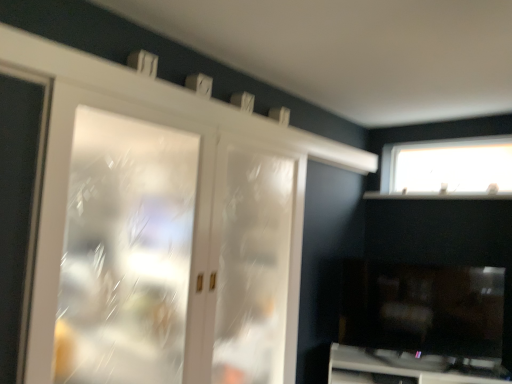
What is the approximate width of clear glass door at center, the 2th screen door in the left-to-right sequence?

The width of clear glass door at center, the 2th screen door in the left-to-right sequence, is 13.12 centimeters.

The image size is (512, 384). Describe the element at coordinates (176, 256) in the screenshot. I see `white frosted glass screen door at left, the first screen door in the left-to-right sequence` at that location.

Where is `white glossy cabinet at lower right`? The height and width of the screenshot is (384, 512). white glossy cabinet at lower right is located at coordinates (409, 368).

Find the location of a particular element. The height and width of the screenshot is (384, 512). transparent glass window at upper right is located at coordinates (448, 167).

Which object is wider, clear glass door at center, the 2th screen door in the left-to-right sequence, or transparent glass window at upper right?

clear glass door at center, the 2th screen door in the left-to-right sequence.

Is clear glass door at center, the first screen door in the right-to-left sequence, to the left of transparent glass window at upper right from the viewer's perspective?

Correct, you'll find clear glass door at center, the first screen door in the right-to-left sequence, to the left of transparent glass window at upper right.

Are clear glass door at center, the 2th screen door in the left-to-right sequence, and transparent glass window at upper right far apart?

Yes, clear glass door at center, the 2th screen door in the left-to-right sequence, and transparent glass window at upper right are quite far apart.

Could you measure the distance between clear glass door at center, the 2th screen door in the left-to-right sequence, and transparent glass window at upper right?

They are 5.03 feet apart.

From a real-world perspective, is clear glass door at center, the first screen door in the right-to-left sequence, under white frosted glass screen door at left, the first screen door in the left-to-right sequence?

Yes, from a real-world perspective, clear glass door at center, the first screen door in the right-to-left sequence, is beneath white frosted glass screen door at left, the first screen door in the left-to-right sequence.

Looking at the image, does clear glass door at center, placed as the second screen door when sorted from front to back, seem bigger or smaller compared to white frosted glass screen door at left, the second screen door positioned from the right?

Clearly, clear glass door at center, placed as the second screen door when sorted from front to back, is larger in size than white frosted glass screen door at left, the second screen door positioned from the right.

Is the depth of clear glass door at center, the first screen door in the right-to-left sequence, less than that of white frosted glass screen door at left, the 1th screen door from the front?

No, clear glass door at center, the first screen door in the right-to-left sequence, is further to the viewer.

Is clear glass door at center, positioned as the 1th screen door in back-to-front order, shorter than white frosted glass screen door at left, the second screen door positioned from the back?

No, clear glass door at center, positioned as the 1th screen door in back-to-front order, is not shorter than white frosted glass screen door at left, the second screen door positioned from the back.

Is white frosted glass screen door at left, the first screen door in the left-to-right sequence, looking in the opposite direction of white glossy cabinet at lower right?

white frosted glass screen door at left, the first screen door in the left-to-right sequence, is not turned away from white glossy cabinet at lower right.

From the image's perspective, is white frosted glass screen door at left, the 1th screen door from the front, positioned above or below white glossy cabinet at lower right?

From the image's perspective, white frosted glass screen door at left, the 1th screen door from the front, appears above white glossy cabinet at lower right.

Considering the positions of objects white frosted glass screen door at left, the second screen door positioned from the right, and white glossy cabinet at lower right in the image provided, who is more to the left, white frosted glass screen door at left, the second screen door positioned from the right, or white glossy cabinet at lower right?

white frosted glass screen door at left, the second screen door positioned from the right, is more to the left.

Considering the sizes of objects white glossy cabinet at lower right and white frosted glass screen door at left, the first screen door in the left-to-right sequence, in the image provided, who is taller, white glossy cabinet at lower right or white frosted glass screen door at left, the first screen door in the left-to-right sequence,?

With more height is white frosted glass screen door at left, the first screen door in the left-to-right sequence.

Considering the sizes of objects white glossy cabinet at lower right and white frosted glass screen door at left, the second screen door positioned from the right, in the image provided, who is thinner, white glossy cabinet at lower right or white frosted glass screen door at left, the second screen door positioned from the right,?

white frosted glass screen door at left, the second screen door positioned from the right.

Considering the relative positions of white glossy cabinet at lower right and white frosted glass screen door at left, the first screen door in the left-to-right sequence, in the image provided, is white glossy cabinet at lower right to the left or to the right of white frosted glass screen door at left, the first screen door in the left-to-right sequence,?

white glossy cabinet at lower right is positioned on white frosted glass screen door at left, the first screen door in the left-to-right sequence,'s right side.

In the scene shown: Would you say white glossy cabinet at lower right is outside white frosted glass screen door at left, the first screen door in the left-to-right sequence?

Yes, white glossy cabinet at lower right is not within white frosted glass screen door at left, the first screen door in the left-to-right sequence.

Measure the distance between white glossy cabinet at lower right and clear glass door at center, placed as the second screen door when sorted from front to back.

white glossy cabinet at lower right and clear glass door at center, placed as the second screen door when sorted from front to back, are 3.74 feet apart from each other.

Is clear glass door at center, the 2th screen door in the left-to-right sequence, located within white glossy cabinet at lower right?

No, clear glass door at center, the 2th screen door in the left-to-right sequence, is located outside of white glossy cabinet at lower right.

In order to click on cabinetry below the clear glass door at center, the 2th screen door in the left-to-right sequence (from the image's perspective) in this screenshot , I will do 409,368.

From a real-world perspective, is white glossy cabinet at lower right on clear glass door at center, the 2th screen door in the left-to-right sequence?

Incorrect, from a real-world perspective, white glossy cabinet at lower right is lower than clear glass door at center, the 2th screen door in the left-to-right sequence.

Are transparent glass window at upper right and white glossy cabinet at lower right located far from each other?

Indeed, transparent glass window at upper right is not near white glossy cabinet at lower right.

Between transparent glass window at upper right and white glossy cabinet at lower right, which one is positioned in front?

white glossy cabinet at lower right is closer to the camera.

Is transparent glass window at upper right thinner than white glossy cabinet at lower right?

Indeed, transparent glass window at upper right has a lesser width compared to white glossy cabinet at lower right.

Between transparent glass window at upper right and white glossy cabinet at lower right, which one has less height?

Standing shorter between the two is white glossy cabinet at lower right.

In the image, is transparent glass window at upper right positioned in front of or behind white frosted glass screen door at left, the second screen door positioned from the right?

transparent glass window at upper right is behind white frosted glass screen door at left, the second screen door positioned from the right.

Would you consider transparent glass window at upper right to be distant from white frosted glass screen door at left, the second screen door positioned from the right?

Yes.

From the image's perspective, does transparent glass window at upper right appear higher than white frosted glass screen door at left, the 1th screen door from the front?

Yes, from the image's perspective, transparent glass window at upper right is above white frosted glass screen door at left, the 1th screen door from the front.

At what (x,y) coordinates should I click in order to perform the action: click on window behind the clear glass door at center, positioned as the 1th screen door in back-to-front order. Please return your answer as a coordinate pair (x, y). Looking at the image, I should click on (448, 167).

At what (x,y) coordinates should I click in order to perform the action: click on screen door located on the right of white frosted glass screen door at left, the 1th screen door from the front. Please return your answer as a coordinate pair (x, y). Image resolution: width=512 pixels, height=384 pixels. Looking at the image, I should click on (255, 264).

Based on the photo, looking at the image, which one is located closer to transparent glass window at upper right, clear glass door at center, positioned as the 1th screen door in back-to-front order, or white frosted glass screen door at left, the first screen door in the left-to-right sequence?

Among the two, clear glass door at center, positioned as the 1th screen door in back-to-front order, is located nearer to transparent glass window at upper right.

Looking at the image, which one is located further to clear glass door at center, the first screen door in the right-to-left sequence, transparent glass window at upper right or white glossy cabinet at lower right?

transparent glass window at upper right is further to clear glass door at center, the first screen door in the right-to-left sequence.

Considering their positions, is white frosted glass screen door at left, the 1th screen door from the front, positioned further to transparent glass window at upper right than clear glass door at center, positioned as the 1th screen door in back-to-front order?

white frosted glass screen door at left, the 1th screen door from the front, lies further to transparent glass window at upper right than the other object.

From the image, which object appears to be nearer to transparent glass window at upper right, white glossy cabinet at lower right or clear glass door at center, the first screen door in the right-to-left sequence?

Based on the image, white glossy cabinet at lower right appears to be nearer to transparent glass window at upper right.

Consider the image. Considering their positions, is white frosted glass screen door at left, the second screen door positioned from the right, positioned further to clear glass door at center, placed as the second screen door when sorted from front to back, than white glossy cabinet at lower right?

Based on the image, white glossy cabinet at lower right appears to be further to clear glass door at center, placed as the second screen door when sorted from front to back.

From the image, which object appears to be farther from white glossy cabinet at lower right, clear glass door at center, the first screen door in the right-to-left sequence, or transparent glass window at upper right?

transparent glass window at upper right is further to white glossy cabinet at lower right.

Based on their spatial positions, is transparent glass window at upper right or white glossy cabinet at lower right further from white frosted glass screen door at left, the second screen door positioned from the back?

Among the two, transparent glass window at upper right is located further to white frosted glass screen door at left, the second screen door positioned from the back.

Considering their positions, is transparent glass window at upper right positioned further to white frosted glass screen door at left, the 1th screen door from the front, than clear glass door at center, the 2th screen door in the left-to-right sequence?

The object further to white frosted glass screen door at left, the 1th screen door from the front, is transparent glass window at upper right.

You are a GUI agent. You are given a task and a screenshot of the screen. Output one action in this format:
    pyautogui.click(x=<x>, y=<y>)
    Task: Click on the screen door between white frosted glass screen door at left, the second screen door positioned from the back, and white glossy cabinet at lower right, in the horizontal direction
    
    Given the screenshot: What is the action you would take?
    pyautogui.click(x=255, y=264)

Where is `cabinetry situated between white frosted glass screen door at left, the second screen door positioned from the right, and transparent glass window at upper right from left to right`? cabinetry situated between white frosted glass screen door at left, the second screen door positioned from the right, and transparent glass window at upper right from left to right is located at coordinates (409, 368).

The image size is (512, 384). What are the coordinates of `screen door between white frosted glass screen door at left, the second screen door positioned from the right, and transparent glass window at upper right, in the horizontal direction` in the screenshot? It's located at (255, 264).

The image size is (512, 384). I want to click on cabinetry located between clear glass door at center, the 2th screen door in the left-to-right sequence, and transparent glass window at upper right in the left-right direction, so click(x=409, y=368).